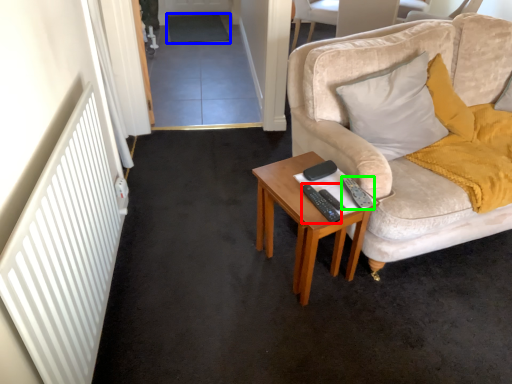
Question: Which is nearer to the remote control (highlighted by a red box)? plain (highlighted by a blue box) or remote control (highlighted by a green box).

Choices:
 (A) plain
 (B) remote control

Answer: (B)